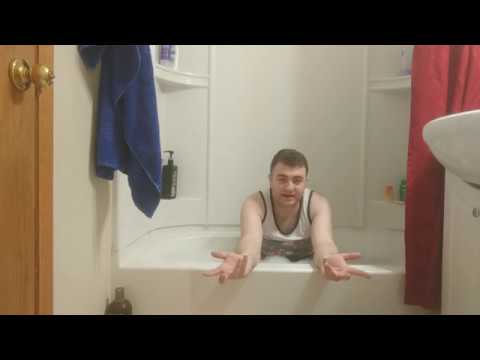
Locate an element on the screen. The height and width of the screenshot is (360, 480). blue towel is located at coordinates (139, 137).